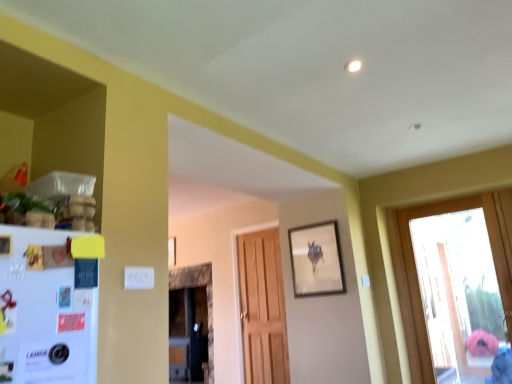
The width and height of the screenshot is (512, 384). I want to click on white matte refrigerator at left, so click(48, 305).

From the picture: What is the approximate width of white matte refrigerator at left?

white matte refrigerator at left is 2.96 inches in width.

You are a GUI agent. You are given a task and a screenshot of the screen. Output one action in this format:
    pyautogui.click(x=<x>, y=<y>)
    Task: Click on the matte wooden picture frame at center, placed as the first picture frame when sorted from left to right
    The width and height of the screenshot is (512, 384).
    Given the screenshot: What is the action you would take?
    pyautogui.click(x=170, y=251)

Visually, is transparent glass door at right positioned to the left or to the right of matte wooden picture frame at upper center, the 2th picture frame viewed from the back?

From the image, it's evident that transparent glass door at right is to the right of matte wooden picture frame at upper center, the 2th picture frame viewed from the back.

From a real-world perspective, which object rests below the other?

From a 3D spatial view, transparent glass door at right is below.

You are a GUI agent. You are given a task and a screenshot of the screen. Output one action in this format:
    pyautogui.click(x=<x>, y=<y>)
    Task: Click on the picture frame that is the 1st one when counting leftward from the transparent glass door at right
    Image resolution: width=512 pixels, height=384 pixels.
    Given the screenshot: What is the action you would take?
    pyautogui.click(x=316, y=260)

What's the angular difference between transparent glass door at right and matte wooden picture frame at upper center, which is the second picture frame from left to right,'s facing directions?

transparent glass door at right and matte wooden picture frame at upper center, which is the second picture frame from left to right, are facing 0.848 degrees away from each other.

Is point (336, 222) more distant than point (14, 377)?

Yes, it is behind point (14, 377).

Image resolution: width=512 pixels, height=384 pixels. There is a white matte refrigerator at left. Identify the location of the 1st picture frame above it (from a real-world perspective). [316, 260].

From a real-world perspective, is matte wooden picture frame at upper center, which appears as the 1th picture frame when viewed from the right, physically located above or below white matte refrigerator at left?

In terms of real-world spatial position, matte wooden picture frame at upper center, which appears as the 1th picture frame when viewed from the right, is above white matte refrigerator at left.

Are matte wooden picture frame at upper center, which is the second picture frame from left to right, and white matte refrigerator at left making contact?

No, matte wooden picture frame at upper center, which is the second picture frame from left to right, is not making contact with white matte refrigerator at left.

Which object is closer to the camera taking this photo, transparent glass door at right or white matte refrigerator at left?

white matte refrigerator at left.

In the scene shown: Does transparent glass door at right have a smaller size compared to white matte refrigerator at left?

No, transparent glass door at right is not smaller than white matte refrigerator at left.

Between transparent glass door at right and white matte refrigerator at left, which one has larger width?

Wider between the two is white matte refrigerator at left.

Is matte wooden picture frame at center, which appears as the 1th picture frame when viewed from the back, not near matte wooden picture frame at upper center, which is the 1th picture frame from front to back?

Yes, matte wooden picture frame at center, which appears as the 1th picture frame when viewed from the back, and matte wooden picture frame at upper center, which is the 1th picture frame from front to back, are quite far apart.

Looking at this image, is matte wooden picture frame at center, which appears as the 1th picture frame when viewed from the back, not within matte wooden picture frame at upper center, which is the 1th picture frame from front to back?

Answer: Yes.

In terms of width, does matte wooden picture frame at center, the second picture frame when ordered from right to left, look wider or thinner when compared to matte wooden picture frame at upper center, the 2th picture frame viewed from the back?

matte wooden picture frame at center, the second picture frame when ordered from right to left, is thinner than matte wooden picture frame at upper center, the 2th picture frame viewed from the back.

Is matte wooden picture frame at center, the second picture frame when ordered from right to left, positioned with its back to matte wooden picture frame at upper center, which is the 1th picture frame from front to back?

No, matte wooden picture frame at center, the second picture frame when ordered from right to left, is not facing away from matte wooden picture frame at upper center, which is the 1th picture frame from front to back.

Which of these two, white matte refrigerator at left or matte wooden picture frame at center, the second picture frame when ordered from right to left, stands taller?

Standing taller between the two is white matte refrigerator at left.

Is white matte refrigerator at left wider or thinner than matte wooden picture frame at center, placed as the first picture frame when sorted from left to right?

Clearly, white matte refrigerator at left has more width compared to matte wooden picture frame at center, placed as the first picture frame when sorted from left to right.

Which is more to the left, white matte refrigerator at left or matte wooden picture frame at center, which ranks as the 2th picture frame in front-to-back order?

matte wooden picture frame at center, which ranks as the 2th picture frame in front-to-back order.

From the picture: Could you tell me if white matte refrigerator at left is facing matte wooden picture frame at center, placed as the first picture frame when sorted from left to right?

No, white matte refrigerator at left is not aimed at matte wooden picture frame at center, placed as the first picture frame when sorted from left to right.

Is matte wooden picture frame at center, which appears as the 1th picture frame when viewed from the back, oriented towards transparent glass door at right?

No, matte wooden picture frame at center, which appears as the 1th picture frame when viewed from the back, is not turned towards transparent glass door at right.

Considering the relative sizes of matte wooden picture frame at center, the second picture frame when ordered from right to left, and transparent glass door at right in the image provided, is matte wooden picture frame at center, the second picture frame when ordered from right to left, bigger than transparent glass door at right?

No, matte wooden picture frame at center, the second picture frame when ordered from right to left, is not bigger than transparent glass door at right.

Locate an element on the screen. The image size is (512, 384). window located in front of the matte wooden picture frame at center, which ranks as the 2th picture frame in front-to-back order is located at coordinates (456, 287).

Is matte wooden picture frame at upper center, which appears as the 1th picture frame when viewed from the right, looking in the opposite direction of matte wooden picture frame at center, which ranks as the 2th picture frame in front-to-back order?

matte wooden picture frame at upper center, which appears as the 1th picture frame when viewed from the right, is not turned away from matte wooden picture frame at center, which ranks as the 2th picture frame in front-to-back order.

Is matte wooden picture frame at upper center, which appears as the 1th picture frame when viewed from the right, smaller than matte wooden picture frame at center, which appears as the 1th picture frame when viewed from the back?

Actually, matte wooden picture frame at upper center, which appears as the 1th picture frame when viewed from the right, might be larger than matte wooden picture frame at center, which appears as the 1th picture frame when viewed from the back.

Consider the image. Between matte wooden picture frame at upper center, the 2th picture frame viewed from the back, and matte wooden picture frame at center, which appears as the 1th picture frame when viewed from the back, which one has smaller width?

Thinner between the two is matte wooden picture frame at center, which appears as the 1th picture frame when viewed from the back.

The image size is (512, 384). What are the coordinates of `picture frame above the transparent glass door at right (from the image's perspective)` in the screenshot? It's located at (316, 260).

Identify the location of fridge on the left of the matte wooden picture frame at upper center, which is the 1th picture frame from front to back. (48, 305).

Considering their positions, is transparent glass door at right positioned closer to matte wooden picture frame at upper center, which appears as the 1th picture frame when viewed from the right, than white matte refrigerator at left?

Among the two, white matte refrigerator at left is located nearer to matte wooden picture frame at upper center, which appears as the 1th picture frame when viewed from the right.

Estimate the real-world distances between objects in this image. Which object is closer to white matte refrigerator at left, matte wooden picture frame at upper center, which is the second picture frame from left to right, or matte wooden picture frame at center, which appears as the 1th picture frame when viewed from the back?

matte wooden picture frame at upper center, which is the second picture frame from left to right, lies closer to white matte refrigerator at left than the other object.

Looking at the image, which one is located further to transparent glass door at right, matte wooden picture frame at center, the second picture frame when ordered from right to left, or matte wooden picture frame at upper center, which appears as the 1th picture frame when viewed from the right?

matte wooden picture frame at center, the second picture frame when ordered from right to left.

Estimate the real-world distances between objects in this image. Which object is further from white matte refrigerator at left, transparent glass door at right or matte wooden picture frame at center, which appears as the 1th picture frame when viewed from the back?

matte wooden picture frame at center, which appears as the 1th picture frame when viewed from the back, lies further to white matte refrigerator at left than the other object.

When comparing their distances from matte wooden picture frame at upper center, which is the 1th picture frame from front to back, does matte wooden picture frame at center, which ranks as the 2th picture frame in front-to-back order, or white matte refrigerator at left seem further?

matte wooden picture frame at center, which ranks as the 2th picture frame in front-to-back order, is positioned further to the anchor matte wooden picture frame at upper center, which is the 1th picture frame from front to back.

When comparing their distances from transparent glass door at right, does white matte refrigerator at left or matte wooden picture frame at upper center, the 2th picture frame viewed from the back, seem closer?

The object closer to transparent glass door at right is matte wooden picture frame at upper center, the 2th picture frame viewed from the back.

From the image, which object appears to be nearer to white matte refrigerator at left, transparent glass door at right or matte wooden picture frame at upper center, which is the 1th picture frame from front to back?

matte wooden picture frame at upper center, which is the 1th picture frame from front to back.

Estimate the real-world distances between objects in this image. Which object is closer to matte wooden picture frame at upper center, which is the second picture frame from left to right, white matte refrigerator at left or matte wooden picture frame at center, the second picture frame when ordered from right to left?

white matte refrigerator at left.

Where is `window between white matte refrigerator at left and matte wooden picture frame at center, which appears as the 1th picture frame when viewed from the back, from front to back`? window between white matte refrigerator at left and matte wooden picture frame at center, which appears as the 1th picture frame when viewed from the back, from front to back is located at coordinates (456, 287).

Find the location of a particular element. picture frame between transparent glass door at right and matte wooden picture frame at center, placed as the first picture frame when sorted from left to right, along the z-axis is located at coordinates (316, 260).

The width and height of the screenshot is (512, 384). I want to click on picture frame between white matte refrigerator at left and matte wooden picture frame at center, which ranks as the 2th picture frame in front-to-back order, in the front-back direction, so click(316, 260).

At what (x,y) coordinates should I click in order to perform the action: click on window between white matte refrigerator at left and matte wooden picture frame at upper center, the 2th picture frame viewed from the back, from front to back. Please return your answer as a coordinate pair (x, y). Looking at the image, I should click on (456, 287).